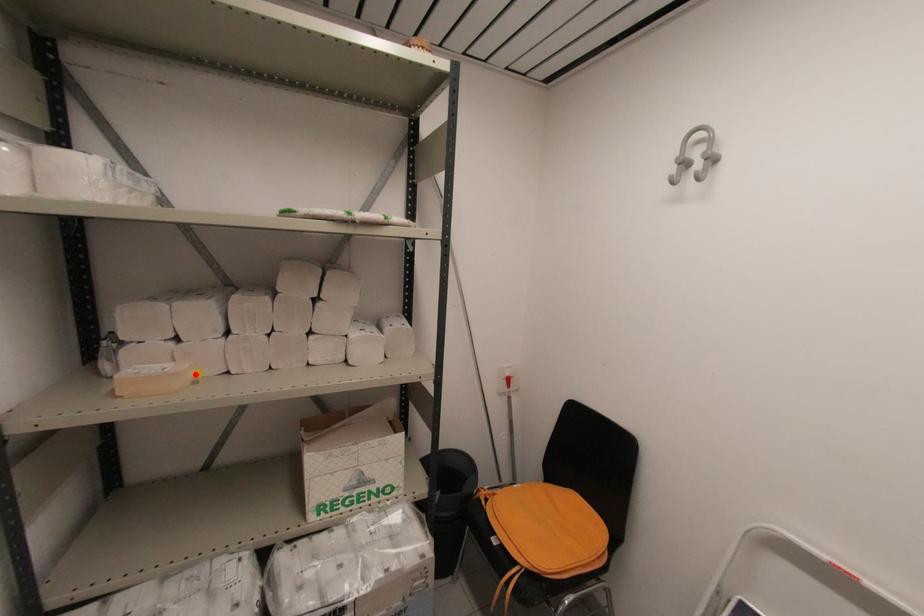
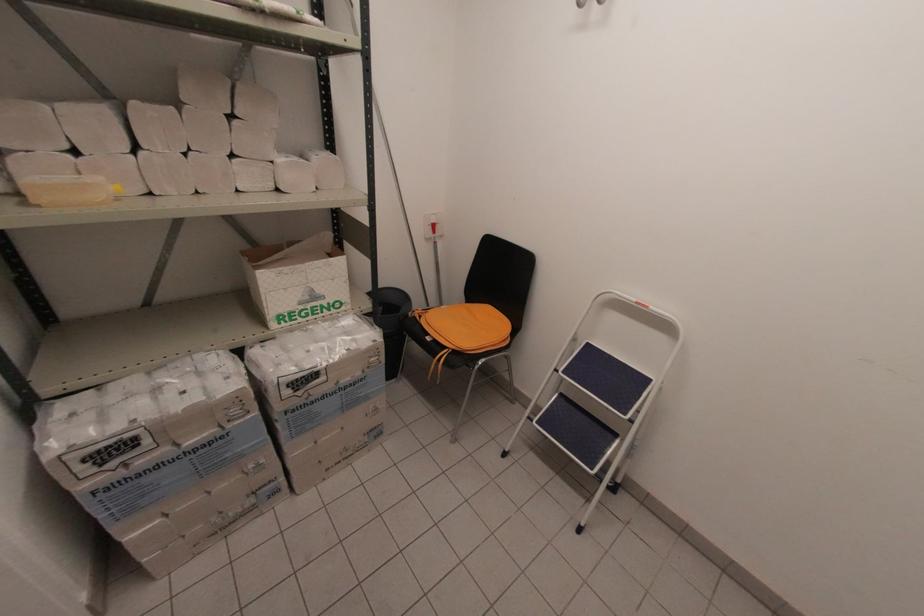
Find the pixel in the second image that matches the highlighted location in the first image.

(116, 188)